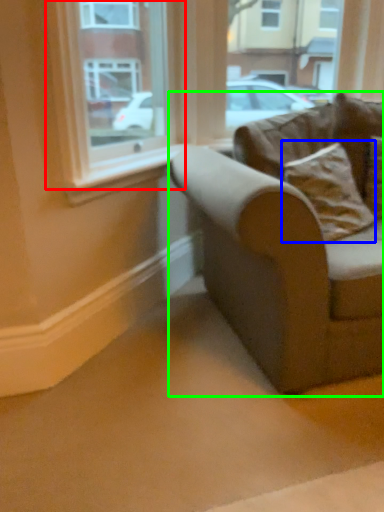
Question: Estimate the real-world distances between objects in this image. Which object is farther from window (highlighted by a red box), pillow (highlighted by a blue box) or studio couch (highlighted by a green box)?

Choices:
 (A) pillow
 (B) studio couch

Answer: (B)